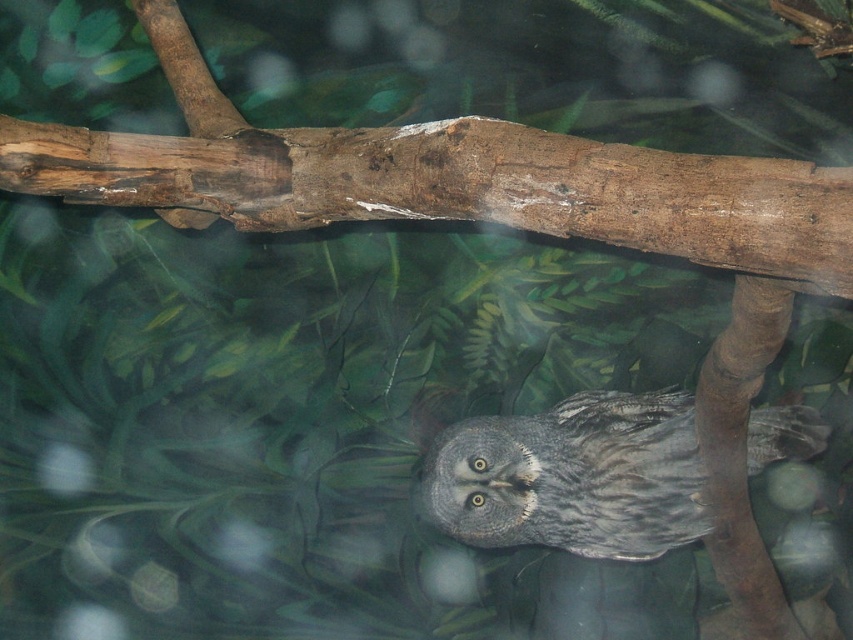
Is point (630, 157) positioned before point (492, 497)?

That is True.

Is brown rough wood at upper center closer to the viewer compared to gray fluffy owl at center?

Yes, brown rough wood at upper center is closer to the viewer.

The height and width of the screenshot is (640, 853). Describe the element at coordinates (440, 179) in the screenshot. I see `brown rough wood at upper center` at that location.

The width and height of the screenshot is (853, 640). Find the location of `brown rough wood at upper center`. brown rough wood at upper center is located at coordinates (440, 179).